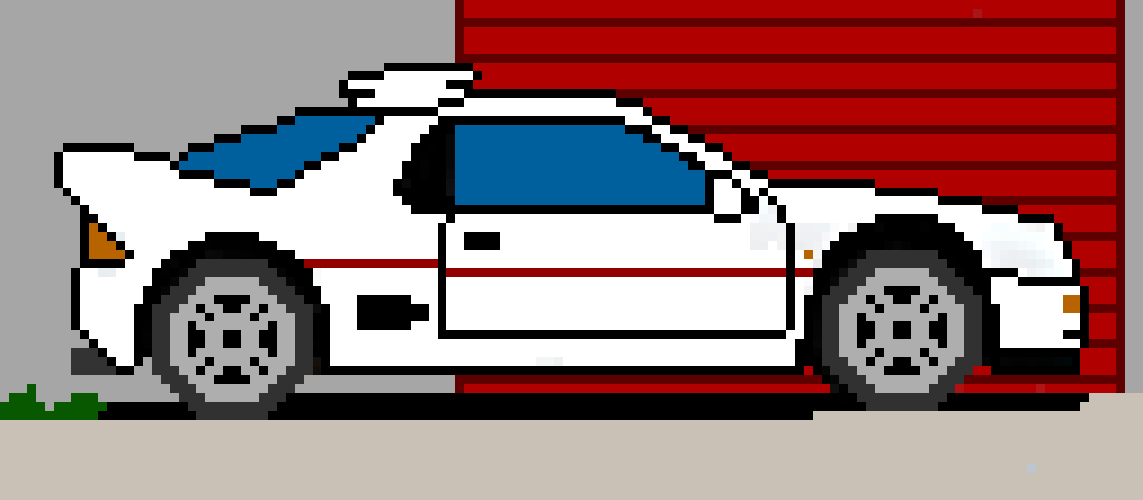
Image resolution: width=1143 pixels, height=500 pixels. In order to click on door handle in this screenshot , I will do `click(480, 241)`.